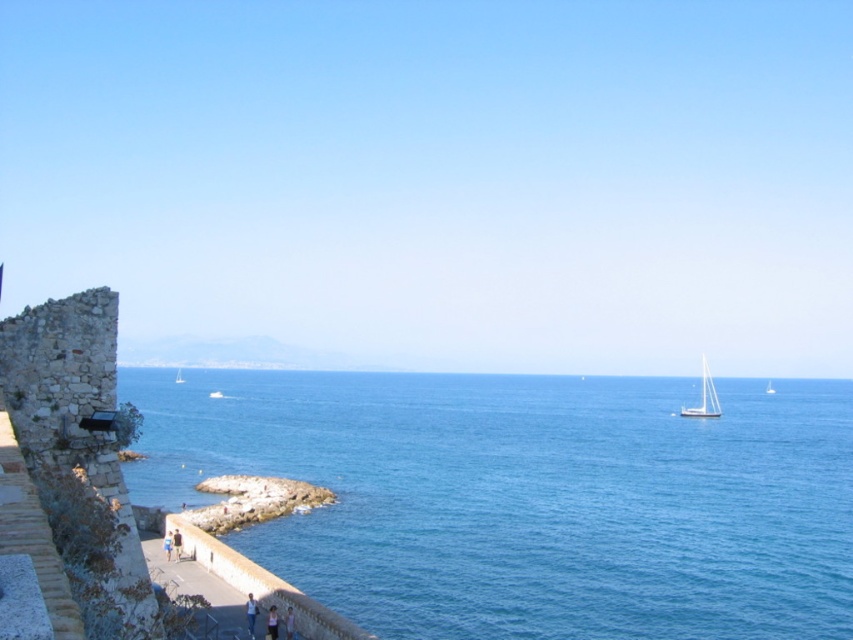
Question: Does blue water at lower left come behind white glossy sailboat at right?

Choices:
 (A) no
 (B) yes

Answer: (A)

Question: Which object appears closest to the camera in this image?

Choices:
 (A) light blue denim shorts at lower center
 (B) light brown leather jacket at lower left

Answer: (A)

Question: Can you confirm if blue water at lower left is wider than blue fabric person at lower center?

Choices:
 (A) yes
 (B) no

Answer: (A)

Question: Among these objects, which one is farthest from the camera?

Choices:
 (A) white sailboat at right
 (B) light blue denim shorts at lower center
 (C) white glossy sailboat at center
 (D) blue water at lower left

Answer: (C)

Question: Can you confirm if rustic stone fort at left is positioned below smooth stone rock at lower center?

Choices:
 (A) yes
 (B) no

Answer: (B)

Question: Among these points, which one is farthest from the camera?

Choices:
 (A) (289, 632)
 (B) (769, 381)
 (C) (737, 541)

Answer: (B)